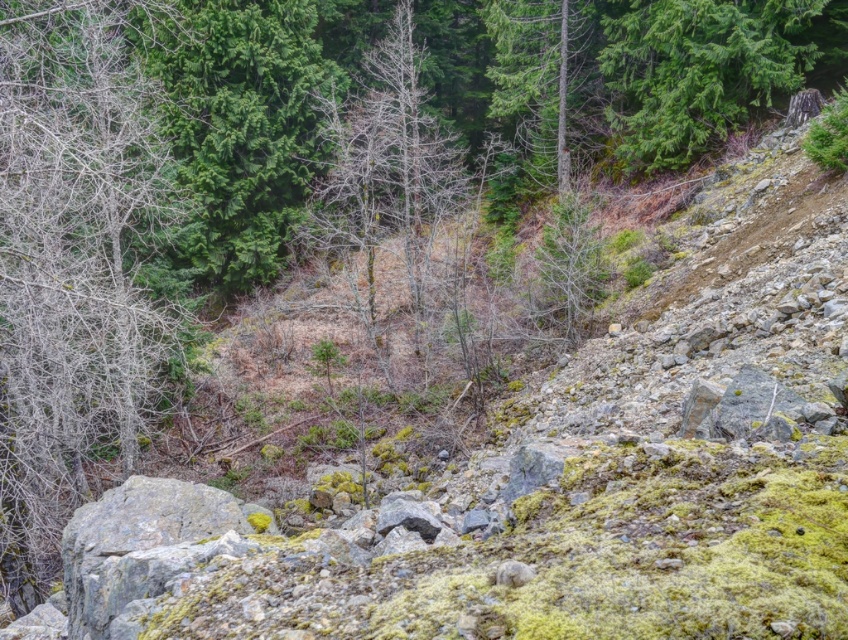
Question: Is bare branches at left below green textured tree at upper right?

Choices:
 (A) yes
 (B) no

Answer: (A)

Question: Which of the following is the closest to the observer?

Choices:
 (A) green textured tree at upper right
 (B) bare branches at left

Answer: (B)

Question: Among these objects, which one is nearest to the camera?

Choices:
 (A) green textured tree at upper right
 (B) bare branches at left

Answer: (B)

Question: Can you confirm if bare branches at left is bigger than green textured tree at upper right?

Choices:
 (A) no
 (B) yes

Answer: (B)

Question: Can you confirm if bare branches at left is wider than green textured tree at upper right?

Choices:
 (A) yes
 (B) no

Answer: (A)

Question: Which point appears farthest from the camera in this image?

Choices:
 (A) (804, 49)
 (B) (127, 154)

Answer: (A)